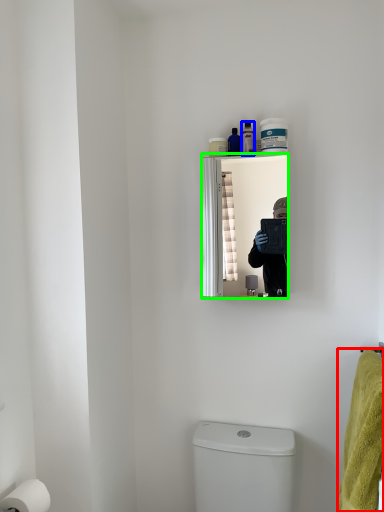
Question: Which is farther away from bath towel (highlighted by a red box)? toiletry (highlighted by a blue box) or mirror (highlighted by a green box)?

Choices:
 (A) toiletry
 (B) mirror

Answer: (A)